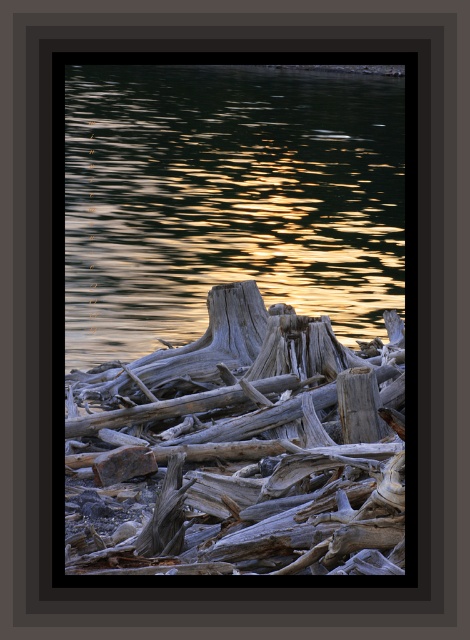
Question: Does glistening water at center appear on the left side of gray weathered wood at center?

Choices:
 (A) no
 (B) yes

Answer: (B)

Question: Can you confirm if glistening water at center is smaller than gray rough wood at center?

Choices:
 (A) no
 (B) yes

Answer: (A)

Question: Does gray weathered wood at center appear under gray rough wood at center?

Choices:
 (A) no
 (B) yes

Answer: (A)

Question: Which object is positioned closest to the gray weathered wood at center?

Choices:
 (A) gray rough wood at center
 (B) glistening water at center

Answer: (A)

Question: Which of the following is the closest to the observer?

Choices:
 (A) (148, 307)
 (B) (138, 561)
 (C) (251, 310)

Answer: (B)

Question: Which object is the farthest from the gray weathered wood at center?

Choices:
 (A) gray rough wood at center
 (B) glistening water at center

Answer: (B)